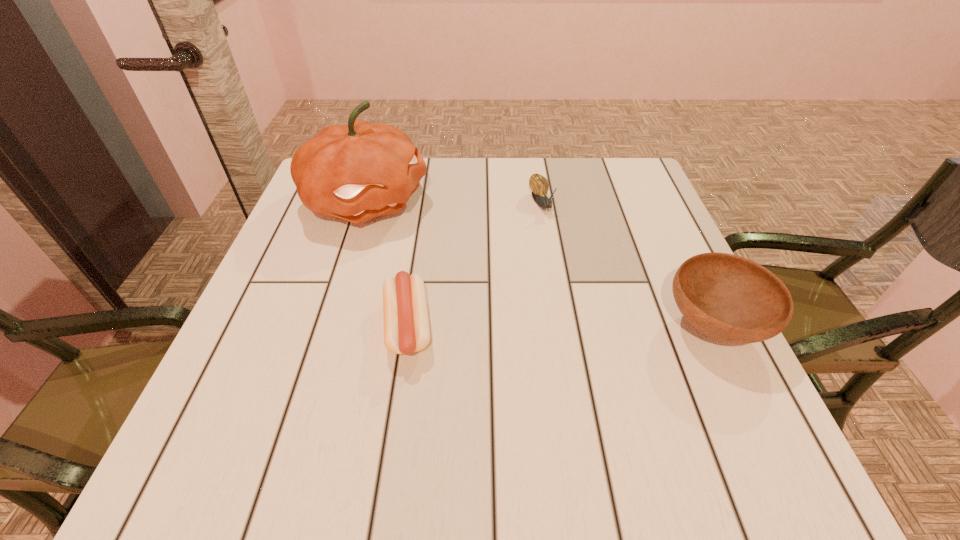
In the image, there is a desktop. At what (x,y) coordinates should I click in order to perform the action: click on free space at the left edge. Please return your answer as a coordinate pair (x, y). Looking at the image, I should click on (327, 335).

The height and width of the screenshot is (540, 960). In the image, there is a desktop. In order to click on vacant space at the right edge in this screenshot , I will do `click(629, 249)`.

Identify the location of vacant area at the near left corner of the desktop. (256, 418).

At what (x,y) coordinates should I click in order to perform the action: click on vacant space at the far right corner of the desktop. Please return your answer as a coordinate pair (x, y). The width and height of the screenshot is (960, 540). Looking at the image, I should click on (636, 183).

In the image, there is a desktop. Identify the location of vacant area at the near right corner. (728, 390).

Find the location of a particular element. The height and width of the screenshot is (540, 960). free spot between the bowl and the pumpkin is located at coordinates (540, 263).

In order to click on free point between the pumpkin and the sausage in this screenshot , I will do `click(387, 264)`.

I want to click on vacant space that is in between the second object from right to left and the sausage, so click(474, 266).

Where is `blank region between the tallest object and the sausage`? The image size is (960, 540). blank region between the tallest object and the sausage is located at coordinates (387, 264).

The width and height of the screenshot is (960, 540). I want to click on unoccupied area between the third object from left to right and the sausage, so click(474, 266).